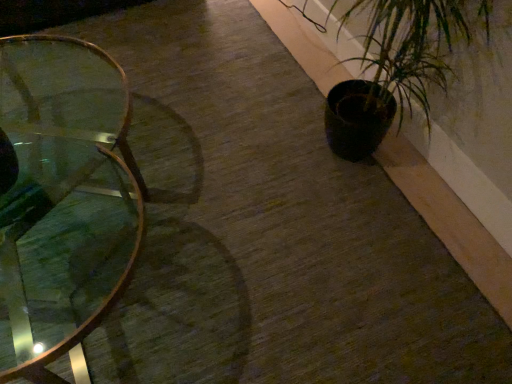
Question: Is dark matte pot at right facing towards clear glass table at left?

Choices:
 (A) yes
 (B) no

Answer: (A)

Question: Is dark matte pot at right further to camera compared to clear glass table at left?

Choices:
 (A) yes
 (B) no

Answer: (A)

Question: Considering the relative sizes of dark matte pot at right and clear glass table at left in the image provided, is dark matte pot at right smaller than clear glass table at left?

Choices:
 (A) yes
 (B) no

Answer: (A)

Question: Is dark matte pot at right wider than clear glass table at left?

Choices:
 (A) no
 (B) yes

Answer: (A)

Question: Can you confirm if dark matte pot at right is shorter than clear glass table at left?

Choices:
 (A) yes
 (B) no

Answer: (B)

Question: From a real-world perspective, is dark matte pot at right beneath clear glass table at left?

Choices:
 (A) no
 (B) yes

Answer: (A)

Question: Does clear glass table at left lie in front of dark matte pot at right?

Choices:
 (A) no
 (B) yes

Answer: (B)

Question: From the image's perspective, is clear glass table at left below dark matte pot at right?

Choices:
 (A) no
 (B) yes

Answer: (B)

Question: Can you confirm if clear glass table at left is wider than dark matte pot at right?

Choices:
 (A) no
 (B) yes

Answer: (B)

Question: From the image's perspective, is clear glass table at left above dark matte pot at right?

Choices:
 (A) yes
 (B) no

Answer: (B)

Question: Considering the relative positions of clear glass table at left and dark matte pot at right in the image provided, is clear glass table at left to the left of dark matte pot at right from the viewer's perspective?

Choices:
 (A) no
 (B) yes

Answer: (B)

Question: From a real-world perspective, is clear glass table at left physically below dark matte pot at right?

Choices:
 (A) no
 (B) yes

Answer: (B)

Question: Is point (416, 16) closer or farther from the camera than point (16, 326)?

Choices:
 (A) closer
 (B) farther

Answer: (A)